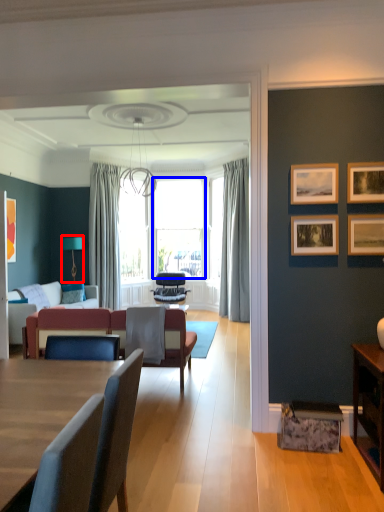
Question: Which object appears closest to the camera in this image, lamp (highlighted by a red box) or window screen (highlighted by a blue box)?

Choices:
 (A) lamp
 (B) window screen

Answer: (A)